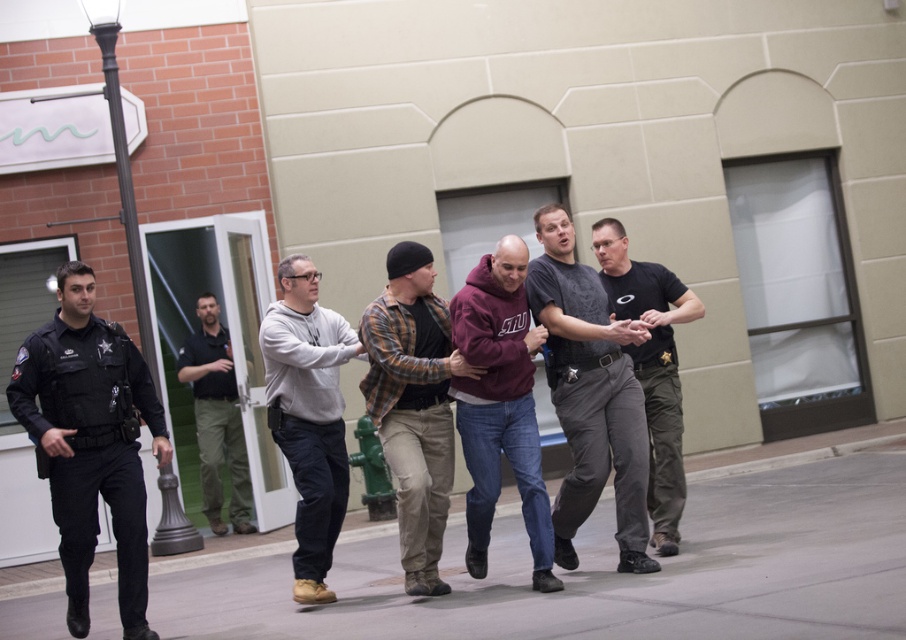
Is gray concrete pavement at center closer to the viewer compared to black uniform at center?

Yes, gray concrete pavement at center is in front of black uniform at center.

Which is more to the right, gray concrete pavement at center or black uniform at center?

gray concrete pavement at center

I want to click on gray concrete pavement at center, so click(609, 573).

Who is taller, maroon hoodie at center or black uniform at center?

Standing taller between the two is black uniform at center.

Who is higher up, maroon hoodie at center or black uniform at center?

maroon hoodie at center is above.

Does point (471, 531) come behind point (211, 513)?

No, it is in front of (211, 513).

Identify the location of maroon hoodie at center. The width and height of the screenshot is (906, 640). (500, 404).

Can you confirm if gray fleece sweatshirt at center is wider than black uniform at center?

Incorrect, gray fleece sweatshirt at center's width does not surpass black uniform at center's.

Measure the distance between point (314,403) and camera.

Point (314,403) and camera are 7.20 meters apart.

Between point (323, 481) and point (236, 474), which one is positioned behind?

The point (236, 474) is behind.

The image size is (906, 640). I want to click on gray fleece sweatshirt at center, so click(307, 416).